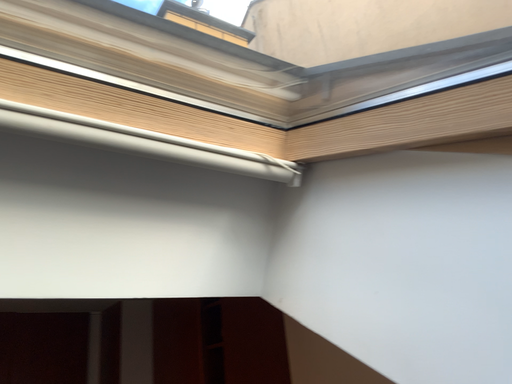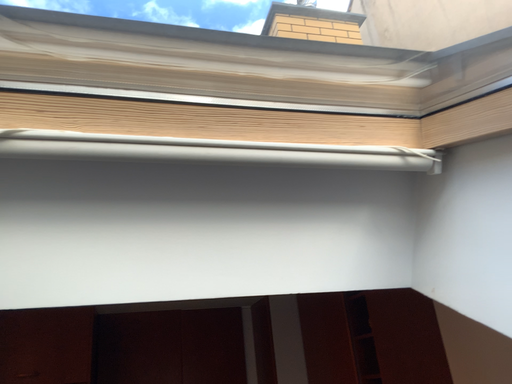
Question: How did the camera likely rotate when shooting the video?

Choices:
 (A) rotated left
 (B) rotated right

Answer: (A)